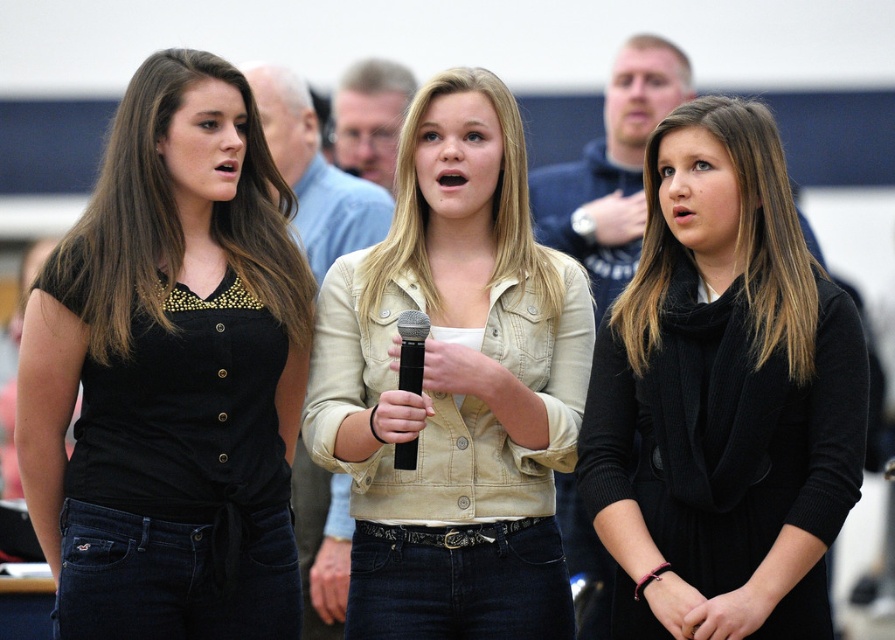
You are standing in the center of the room and want to hand a microphone to the person wearing the black matte shirt at left. In which direction should you move to reach them?

The black matte shirt at left is located at point [171,372], so you should move to the left to reach them.

You are a photographer standing at the back of the room. You need to take a photo that includes both the black matte shirt at left and the black woolen scarf at center. The camera you are using has a maximum focus range of 10 feet. Will you be able to capture both objects clearly in the same frame?

The black matte shirt at left is 9.91 feet from the black woolen scarf at center. Since the distance between them is within the camera s 10 feet focus range, you can capture both objects clearly in the same frame.